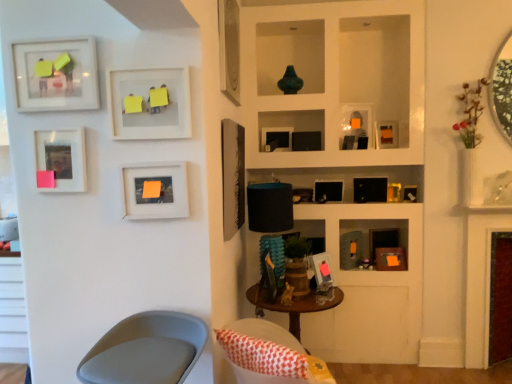
Question: Does matte black picture frame at upper right, which ranks as the second picture frame in right-to-left order, have a smaller size compared to matte white picture frame at left, placed as the 12th picture frame when sorted from right to left?

Choices:
 (A) yes
 (B) no

Answer: (A)

Question: From a real-world perspective, is matte black picture frame at upper right, which ranks as the second picture frame in right-to-left order, positioned over matte white picture frame at left, which is counted as the second picture frame, starting from the left, based on gravity?

Choices:
 (A) yes
 (B) no

Answer: (A)

Question: Is matte white picture frame at left, placed as the 12th picture frame when sorted from right to left, a part of matte black picture frame at upper right, which ranks as the second picture frame in right-to-left order?

Choices:
 (A) no
 (B) yes

Answer: (A)

Question: From a real-world perspective, is matte black picture frame at upper right, arranged as the 12th picture frame when viewed from the left, physically below matte white picture frame at left, which is counted as the second picture frame, starting from the left?

Choices:
 (A) yes
 (B) no

Answer: (B)

Question: From the image's perspective, is matte black picture frame at upper right, arranged as the 12th picture frame when viewed from the left, located above matte white picture frame at left, placed as the 12th picture frame when sorted from right to left?

Choices:
 (A) no
 (B) yes

Answer: (B)

Question: Is matte black picture frame at upper right, arranged as the 12th picture frame when viewed from the left, at the right side of matte white picture frame at left, placed as the 12th picture frame when sorted from right to left?

Choices:
 (A) no
 (B) yes

Answer: (B)

Question: Can you confirm if black matte picture frame at center, the 6th picture frame when ordered from right to left, is thinner than matte black picture frame at upper center, which is counted as the fifth picture frame, starting from the right?

Choices:
 (A) yes
 (B) no

Answer: (B)

Question: From a real-world perspective, does black matte picture frame at center, the 8th picture frame when ordered from left to right, sit lower than matte black picture frame at upper center, which is counted as the fifth picture frame, starting from the right?

Choices:
 (A) yes
 (B) no

Answer: (A)

Question: Can you confirm if black matte picture frame at center, the 8th picture frame when ordered from left to right, is positioned to the left of matte black picture frame at upper center, the 9th picture frame when ordered from left to right?

Choices:
 (A) yes
 (B) no

Answer: (A)

Question: Is black matte picture frame at center, the 6th picture frame when ordered from right to left, directly adjacent to matte black picture frame at upper center, which is counted as the fifth picture frame, starting from the right?

Choices:
 (A) yes
 (B) no

Answer: (B)

Question: Is black matte picture frame at center, the 8th picture frame when ordered from left to right, bigger than matte black picture frame at upper center, the 9th picture frame when ordered from left to right?

Choices:
 (A) yes
 (B) no

Answer: (A)

Question: Does black matte picture frame at center, the 8th picture frame when ordered from left to right, come in front of matte black picture frame at upper center, the 9th picture frame when ordered from left to right?

Choices:
 (A) yes
 (B) no

Answer: (A)

Question: Is maroon velvet fireplace at right far from matte orange picture frame at center-right, which ranks as the 3th picture frame in right-to-left order?

Choices:
 (A) no
 (B) yes

Answer: (A)